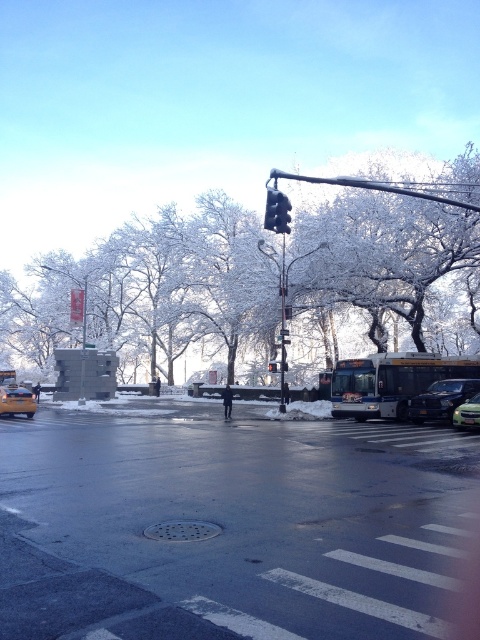
You are a pedestrian standing at the crosswalk. You see the yellow matte taxi at lower left and the black glass traffic light at center. Which object is closer to the crosswalk?

The yellow matte taxi at lower left is closer to the crosswalk because it is located below the black glass traffic light at center, which places it nearer to the pedestrian standing at the crosswalk.

You are a pedestrian waiting at the crosswalk. You see the yellow matte taxi at lower left and the black plastic traffic light at center. Which object is closer to your left side?

The yellow matte taxi at lower left is closer to your left side since it is positioned to the left of the black plastic traffic light at center.

You are a city planner analyzing the winter scene. The white frosty tree at upper center is positioned at coordinates 0.452 on the x and 0.321 on the y. If you want to install a new streetlight exactly 0.1 units to the right and 0.05 units above the tree, what would be the new coordinates for the streetlight?

The new coordinates for the streetlight would be x 0.552 and y 0.371, calculated by adding 0.1 to the tree at upper center x coordinate and 0.05 to its y coordinate.